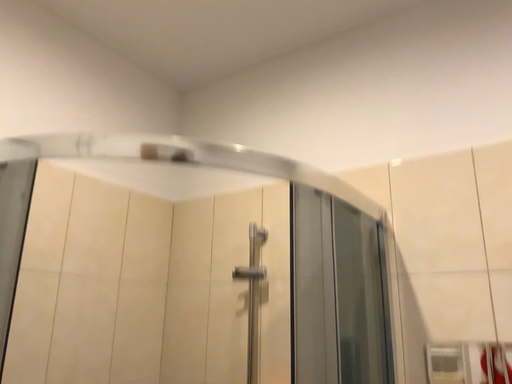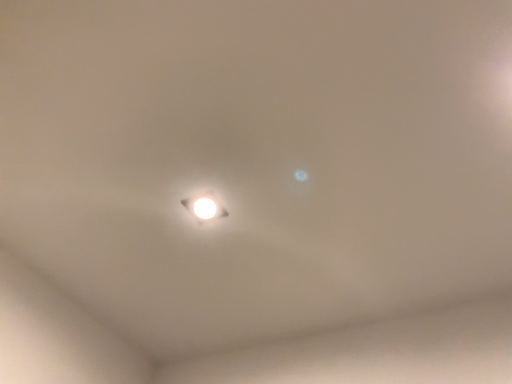
Question: How did the camera likely rotate when shooting the video?

Choices:
 (A) rotated upward
 (B) rotated downward

Answer: (A)